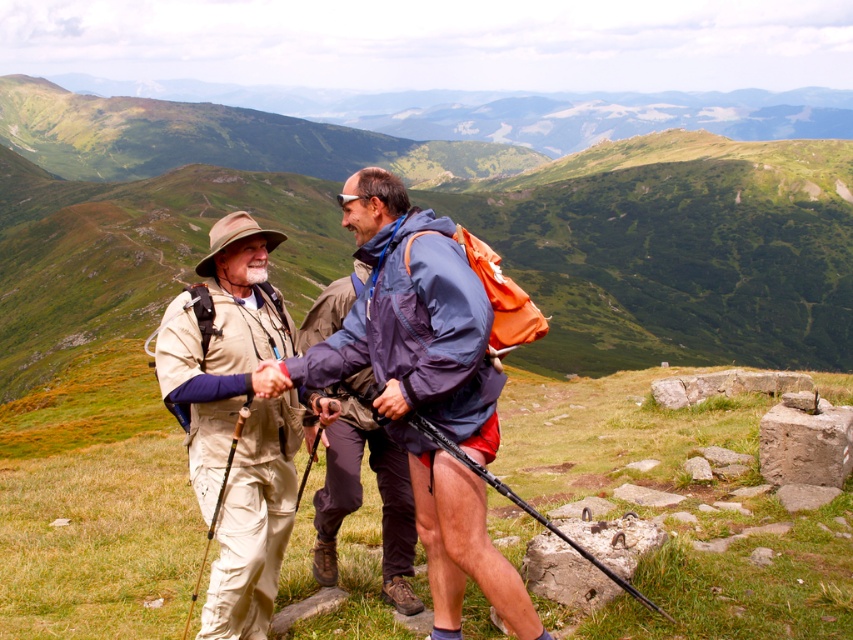
Is khaki cotton pants at center wider than beige fabric hat at center?

Indeed, khaki cotton pants at center has a greater width compared to beige fabric hat at center.

Describe the element at coordinates (421, 380) in the screenshot. This screenshot has width=853, height=640. I see `khaki cotton pants at center` at that location.

Measure the distance between point (463, 369) and camera.

A distance of 26.58 feet exists between point (463, 369) and camera.

Locate an element on the screen. khaki cotton pants at center is located at coordinates click(421, 380).

Is khaki cotton pants at center taller than matte blue jacket at center?

Yes, khaki cotton pants at center is taller than matte blue jacket at center.

In the scene shown: Does khaki cotton pants at center appear on the right side of matte blue jacket at center?

Correct, you'll find khaki cotton pants at center to the right of matte blue jacket at center.

This screenshot has height=640, width=853. I want to click on khaki cotton pants at center, so (x=421, y=380).

Identify the location of khaki cotton pants at center. The image size is (853, 640). (421, 380).

Who is taller, beige fabric hat at center or matte blue jacket at center?

beige fabric hat at center is taller.

Is beige fabric hat at center in front of matte blue jacket at center?

Yes, it is in front of matte blue jacket at center.

Locate an element on the screen. This screenshot has height=640, width=853. beige fabric hat at center is located at coordinates (236, 419).